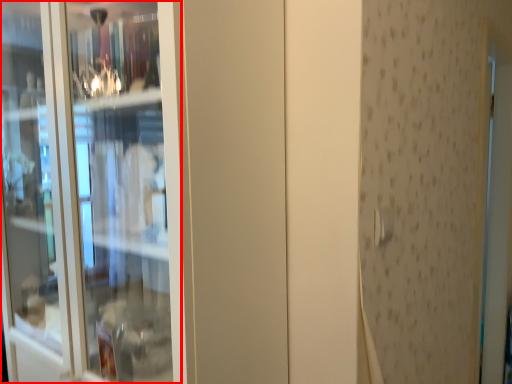
Question: From the image's perspective, where is screen door (annotated by the red box) located in relation to door handle in the image?

Choices:
 (A) below
 (B) above

Answer: (B)